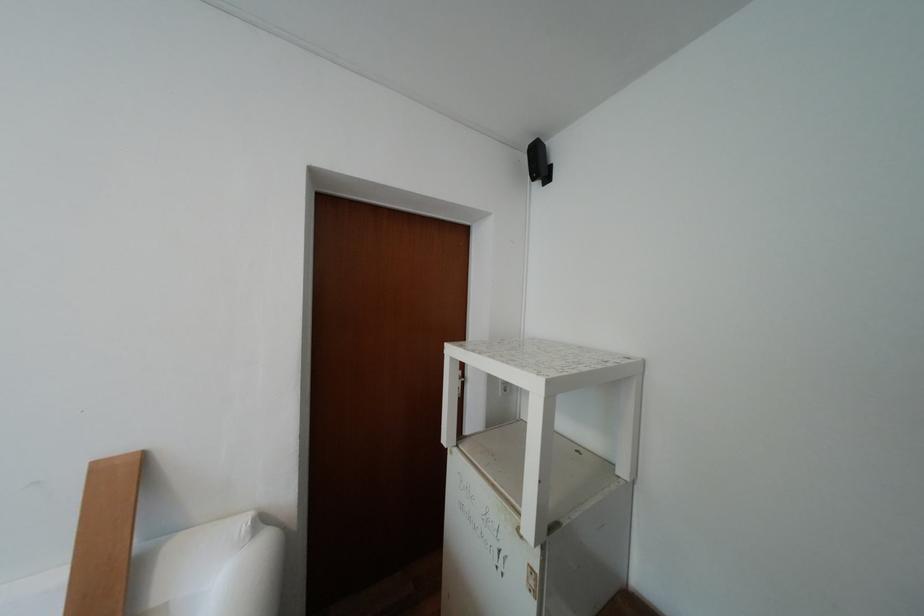
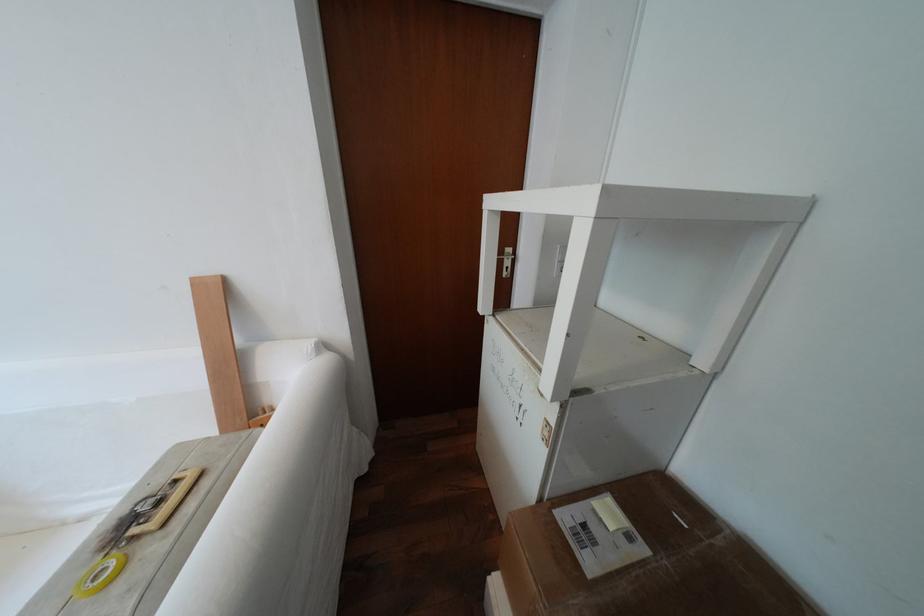
First-person continuous shooting, in which direction is the camera rotating?

The rotation direction of the camera is left-down.